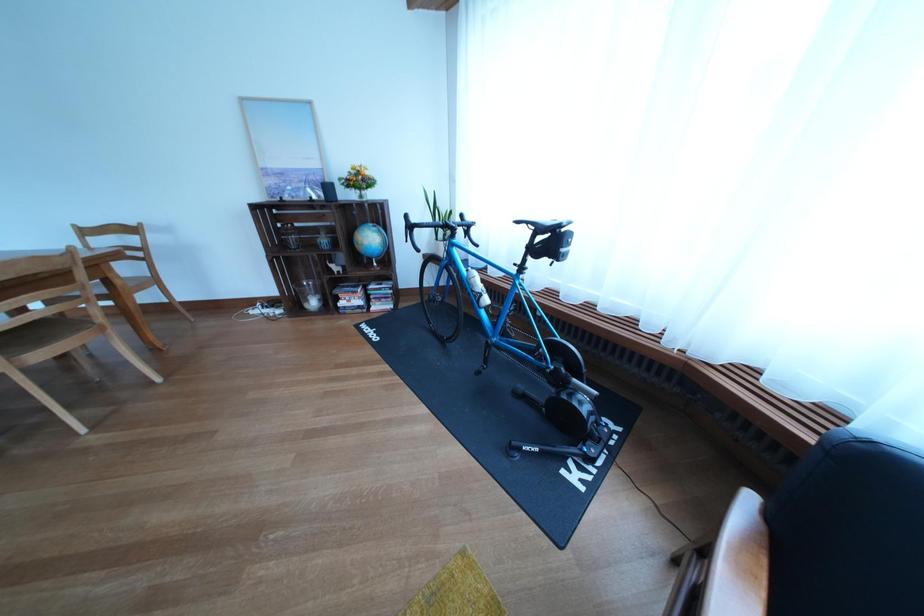
The width and height of the screenshot is (924, 616). In order to click on bicycle saddle in this screenshot , I will do `click(542, 224)`.